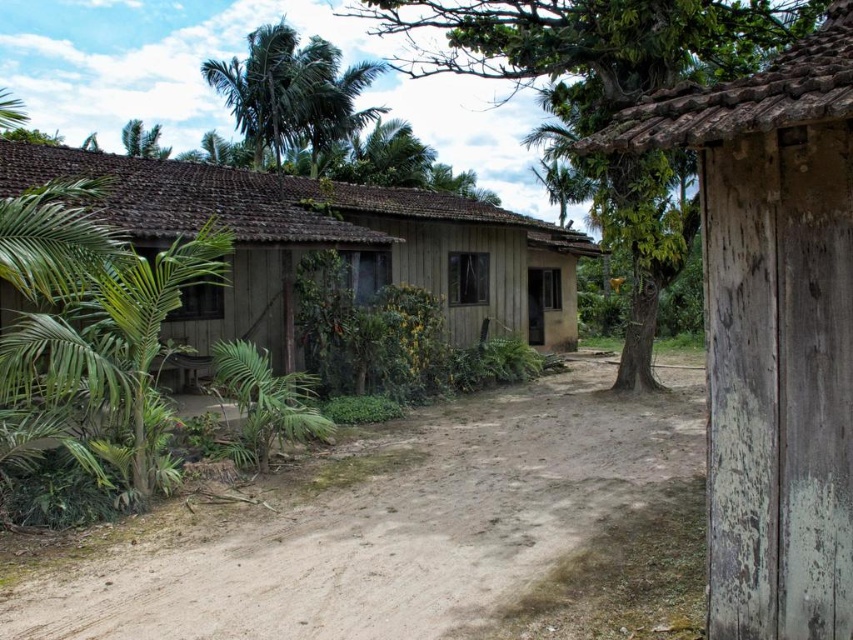
Question: Among these objects, which one is farthest from the camera?

Choices:
 (A) weathered wood hut at right
 (B) green leafy palm tree at upper center
 (C) brown sandy dirt track at lower center

Answer: (B)

Question: Is weathered wood hut at right closer to the viewer compared to green leafy tree at center?

Choices:
 (A) yes
 (B) no

Answer: (A)

Question: Does weathered wood hut at right appear on the right side of green leafy tree at center?

Choices:
 (A) no
 (B) yes

Answer: (A)

Question: Which is nearer to the green leafy tree at center?

Choices:
 (A) brown sandy dirt track at lower center
 (B) brown wooden hut at center

Answer: (B)

Question: Does brown wooden hut at center lie in front of green leafy tree at center?

Choices:
 (A) yes
 (B) no

Answer: (B)

Question: Which object is closer to the camera taking this photo?

Choices:
 (A) green leafy tree at center
 (B) green leafy palm tree at upper center
 (C) brown wooden hut at center
 (D) brown sandy dirt track at lower center

Answer: (A)